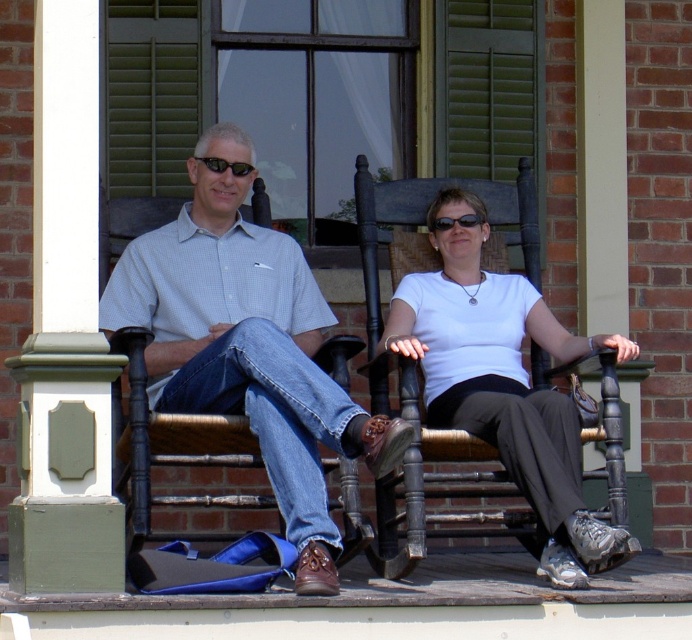
Question: Which object is closer to the camera taking this photo?

Choices:
 (A) white matte shirt at center
 (B) light blue checkered shirt at center
 (C) black plastic sunglasses at upper center

Answer: (B)

Question: Is light blue checkered shirt at center to the right of white matte shirt at center from the viewer's perspective?

Choices:
 (A) no
 (B) yes

Answer: (A)

Question: Which of the following is the farthest from the observer?

Choices:
 (A) white matte shirt at center
 (B) black plastic sunglasses at upper center
 (C) light blue checkered shirt at center

Answer: (B)

Question: Among these objects, which one is farthest from the camera?

Choices:
 (A) black plastic sunglasses at upper center
 (B) white matte shirt at center

Answer: (A)

Question: Does light blue checkered shirt at center appear over white matte shirt at center?

Choices:
 (A) yes
 (B) no

Answer: (A)

Question: From the image, what is the correct spatial relationship of white matte shirt at center in relation to black plastic sunglasses at upper center?

Choices:
 (A) above
 (B) below

Answer: (B)